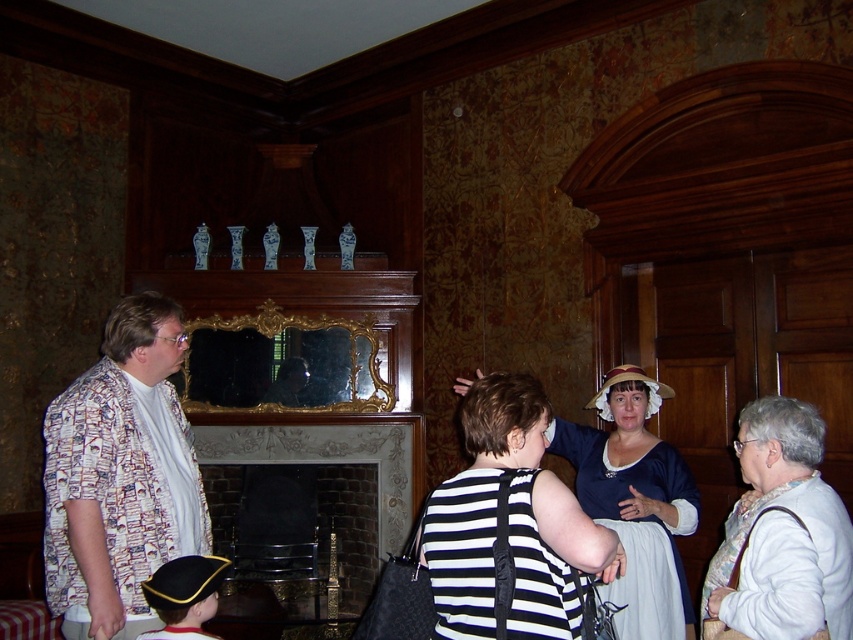
Does point (808, 412) come closer to viewer compared to point (611, 524)?

Yes, it is in front of point (611, 524).

Does point (770, 516) lie behind point (662, 525)?

No, it is in front of (662, 525).

Locate an element on the screen. Image resolution: width=853 pixels, height=640 pixels. white sweater at lower right is located at coordinates (782, 532).

Find the location of a particular element. The image size is (853, 640). matte blue dress at center is located at coordinates (635, 500).

Which of these two, matte blue dress at center or brick fireplace at center, stands shorter?

brick fireplace at center

Identify the location of matte blue dress at center. (635, 500).

Between point (822, 618) and point (320, 454), which one is positioned behind?

The point (320, 454) is behind.

Is point (770, 509) farther from camera compared to point (252, 440)?

No, it is in front of (252, 440).

This screenshot has height=640, width=853. I want to click on white sweater at lower right, so click(x=782, y=532).